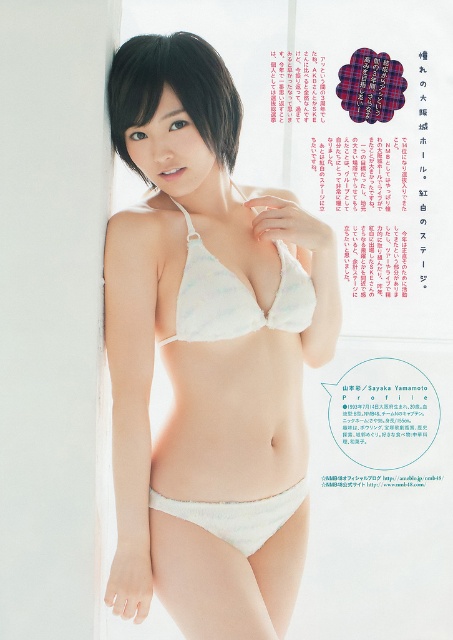
Which of these two, white lace bikini at center or white soft fabric underwear at lower center, stands taller?

Standing taller between the two is white lace bikini at center.

Who is lower down, white lace bikini at center or white soft fabric underwear at lower center?

white soft fabric underwear at lower center

Where is `white lace bikini at center`? white lace bikini at center is located at coordinates (235, 296).

Is white matte lingerie at center positioned behind white lace bikini top at center?

No, white matte lingerie at center is closer to the viewer.

Can you confirm if white matte lingerie at center is positioned to the left of white lace bikini top at center?

Correct, you'll find white matte lingerie at center to the left of white lace bikini top at center.

Between point (293, 205) and point (184, 216), which one is positioned behind?

The point (293, 205) is behind.

The width and height of the screenshot is (453, 640). What are the coordinates of `white matte lingerie at center` in the screenshot? It's located at (207, 355).

Does white lace bikini at center have a greater width compared to dark brown silky hair at upper center?

Yes, white lace bikini at center is wider than dark brown silky hair at upper center.

Who is more forward, (222, 512) or (120, 83)?

Point (120, 83) is in front.

Which is in front, point (303, 284) or point (210, 84)?

Point (210, 84) is more forward.

At what (x,y) coordinates should I click in order to perform the action: click on white lace bikini at center. Please return your answer as a coordinate pair (x, y). Looking at the image, I should click on (235, 296).